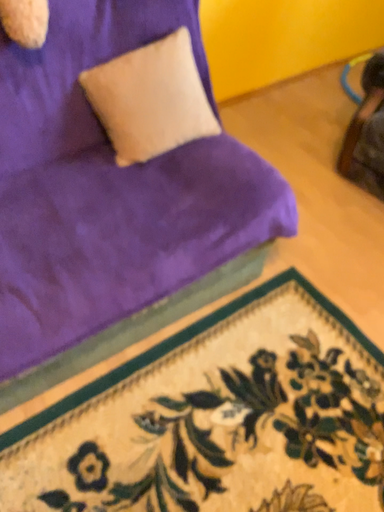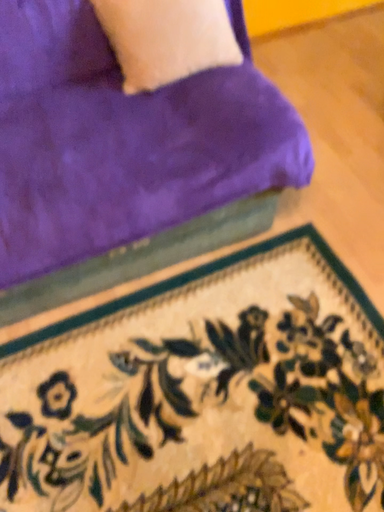
Question: Which way did the camera rotate in the video?

Choices:
 (A) rotated right
 (B) rotated left

Answer: (B)